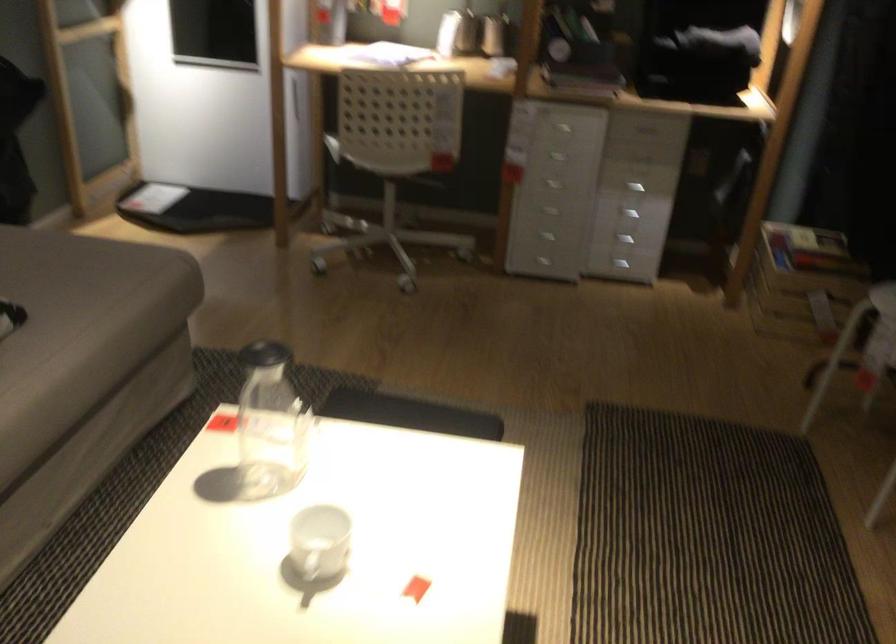
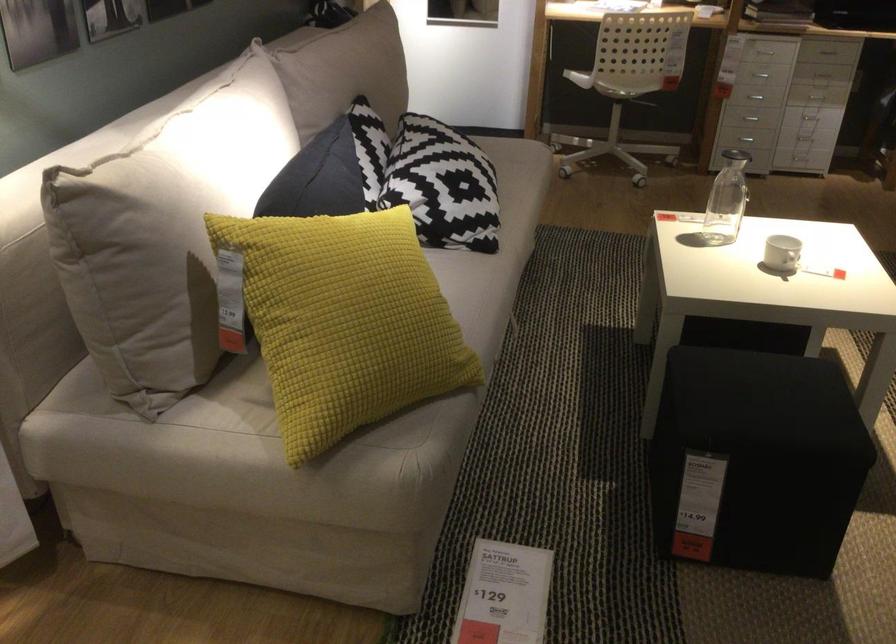
Locate, in the second image, the point that corresponds to (x=601, y=237) in the first image.

(810, 118)